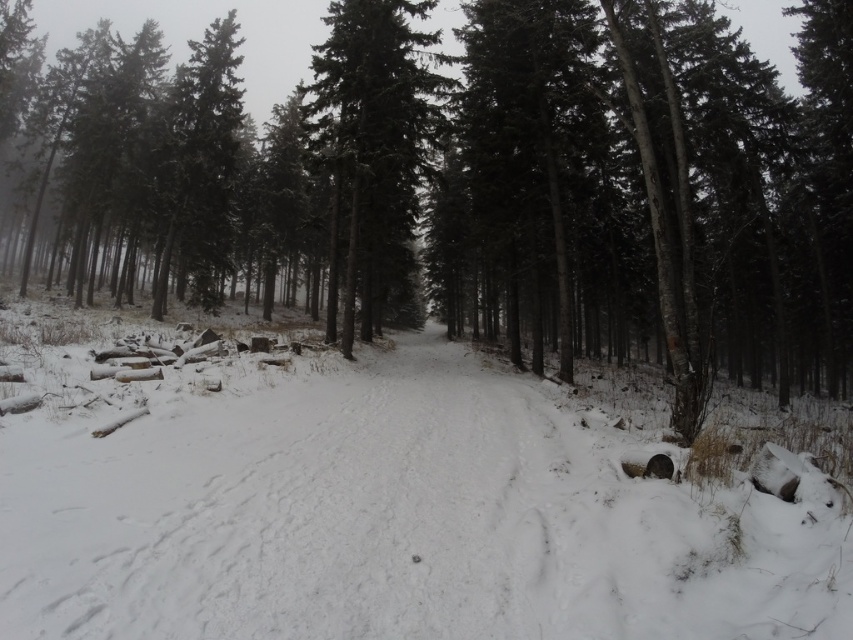
Is green matte tree at center smaller than smooth dark green tree at center?

No.

Does green matte tree at center appear under smooth dark green tree at center?

No.

The height and width of the screenshot is (640, 853). What do you see at coordinates (474, 179) in the screenshot?
I see `green matte tree at center` at bounding box center [474, 179].

The image size is (853, 640). I want to click on green matte tree at center, so click(474, 179).

Identify the location of green matte tree at center. The image size is (853, 640). (474, 179).

Find the location of a particular element. green matte tree at center is located at coordinates (474, 179).

Which is below, white fluffy snow at center or smooth dark green tree at center?

Positioned lower is white fluffy snow at center.

Is point (62, 451) positioned behind point (387, 116)?

No, it is not.

This screenshot has height=640, width=853. Find the location of `white fluffy snow at center`. white fluffy snow at center is located at coordinates (378, 502).